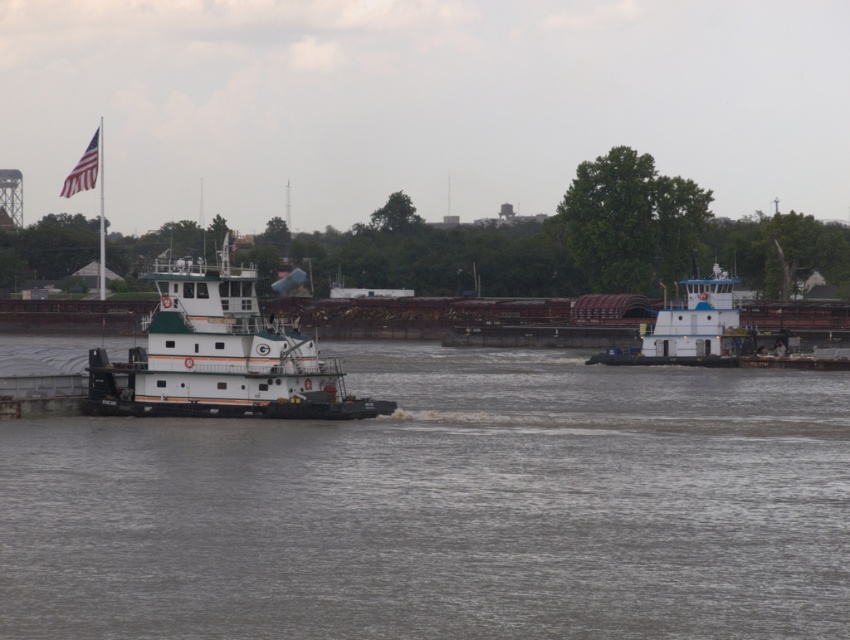
Question: Which object is closer to the camera taking this photo?

Choices:
 (A) white matte tugboat at center
 (B) white matte tugboat at center-right

Answer: (A)

Question: Based on their relative distances, which object is nearer to the white matte tugboat at center-right?

Choices:
 (A) white matte tugboat at center
 (B) gray matte water at center

Answer: (B)

Question: Is white matte tugboat at center positioned before white matte tugboat at center-right?

Choices:
 (A) yes
 (B) no

Answer: (A)

Question: Does gray matte water at center lie behind white matte tugboat at center-right?

Choices:
 (A) no
 (B) yes

Answer: (A)

Question: Which object is closer to the camera taking this photo?

Choices:
 (A) gray matte water at center
 (B) white matte tugboat at center-right

Answer: (A)

Question: Is white matte tugboat at center wider than white matte tugboat at center-right?

Choices:
 (A) no
 (B) yes

Answer: (B)